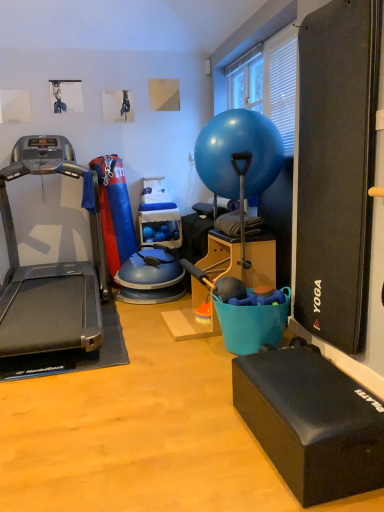
What is the approximate height of black rubber yoga block at lower right, the 2th box positioned from the top?

It is 10.48 inches.

The height and width of the screenshot is (512, 384). I want to click on glossy rubber ball at center, so click(x=239, y=153).

Is teal plastic bucket at center, marked as the 2th box in a bottom-to-top arrangement, oriented towards metallic gray treadmill at left?

Yes, teal plastic bucket at center, marked as the 2th box in a bottom-to-top arrangement, is aimed at metallic gray treadmill at left.

Measure the distance from teal plastic bucket at center, which ranks as the first box in back-to-front order, to metallic gray treadmill at left.

They are 1.17 meters apart.

Can you confirm if teal plastic bucket at center, which ranks as the first box in back-to-front order, is smaller than metallic gray treadmill at left?

Indeed, teal plastic bucket at center, which ranks as the first box in back-to-front order, has a smaller size compared to metallic gray treadmill at left.

What's the angular difference between teal plastic bucket at center, which ranks as the first box in back-to-front order, and metallic gray treadmill at left's facing directions?

The angular difference between teal plastic bucket at center, which ranks as the first box in back-to-front order, and metallic gray treadmill at left is 90 degrees.

Considering the positions of objects glossy rubber ball at center and teal plastic bucket at center, which ranks as the first box in back-to-front order, in the image provided, who is more to the left, glossy rubber ball at center or teal plastic bucket at center, which ranks as the first box in back-to-front order,?

Positioned to the left is teal plastic bucket at center, which ranks as the first box in back-to-front order.

Relative to teal plastic bucket at center, which ranks as the first box in back-to-front order, is glossy rubber ball at center in front or behind?

Visually, glossy rubber ball at center is located in front of teal plastic bucket at center, which ranks as the first box in back-to-front order.

Does glossy rubber ball at center touch teal plastic bucket at center, which is the 2th box in front-to-back order?

No, glossy rubber ball at center is not making contact with teal plastic bucket at center, which is the 2th box in front-to-back order.

From the image's perspective, would you say glossy rubber ball at center is shown under teal plastic bucket at center, which is the 2th box in front-to-back order?

No.

Would you say black rubber yoga block at lower right, the 2th box positioned from the top, is part of glossy rubber ball at center's contents?

That's incorrect, black rubber yoga block at lower right, the 2th box positioned from the top, is not inside glossy rubber ball at center.

Are glossy rubber ball at center and black rubber yoga block at lower right, the first box when ordered from bottom to top, beside each other?

They are not placed beside each other.

From the image's perspective, which one is positioned higher, glossy rubber ball at center or black rubber yoga block at lower right, the first box when ordered from bottom to top?

glossy rubber ball at center, from the image's perspective.

From a real-world perspective, between glossy rubber ball at center and black rubber yoga block at lower right, the 2th box positioned from the top, who is vertically lower?

black rubber yoga block at lower right, the 2th box positioned from the top, from a real-world perspective.

Does metallic gray treadmill at left appear on the right side of black rubber yoga block at lower right, the first box positioned from the front?

No, metallic gray treadmill at left is not to the right of black rubber yoga block at lower right, the first box positioned from the front.

Looking at the image, does metallic gray treadmill at left seem bigger or smaller compared to black rubber yoga block at lower right, the 2th box in the back-to-front sequence?

Clearly, metallic gray treadmill at left is larger in size than black rubber yoga block at lower right, the 2th box in the back-to-front sequence.

Is metallic gray treadmill at left turned away from black rubber yoga block at lower right, the 2th box positioned from the top?

That's not correct — metallic gray treadmill at left is not looking away from black rubber yoga block at lower right, the 2th box positioned from the top.

Can you confirm if metallic gray treadmill at left is taller than black rubber yoga block at lower right, the first box positioned from the front?

Yes.

Is point (257, 270) closer to viewer compared to point (264, 182)?

Yes, point (257, 270) is closer to viewer.

How far apart are teal plastic bucket at center, positioned as the first box in top-to-bottom order, and glossy rubber ball at center?

A: The distance of teal plastic bucket at center, positioned as the first box in top-to-bottom order, from glossy rubber ball at center is 20.46 inches.

What's the angular difference between teal plastic bucket at center, which ranks as the first box in back-to-front order, and glossy rubber ball at center's facing directions?

teal plastic bucket at center, which ranks as the first box in back-to-front order, and glossy rubber ball at center are facing 0.523 degrees away from each other.

Considering the sizes of teal plastic bucket at center, positioned as the first box in top-to-bottom order, and glossy rubber ball at center in the image, is teal plastic bucket at center, positioned as the first box in top-to-bottom order, bigger or smaller than glossy rubber ball at center?

In the image, teal plastic bucket at center, positioned as the first box in top-to-bottom order, appears to be larger than glossy rubber ball at center.

Considering the points (294, 397) and (274, 253), which point is behind, point (294, 397) or point (274, 253)?

The point (274, 253) is more distant.

Considering the relative sizes of black rubber yoga block at lower right, the 2th box in the back-to-front sequence, and teal plastic bucket at center, positioned as the first box in top-to-bottom order, in the image provided, is black rubber yoga block at lower right, the 2th box in the back-to-front sequence, thinner than teal plastic bucket at center, positioned as the first box in top-to-bottom order,?

Yes.

From the image's perspective, is black rubber yoga block at lower right, the 2th box in the back-to-front sequence, below teal plastic bucket at center, which ranks as the first box in back-to-front order?

Indeed, from the image's perspective, black rubber yoga block at lower right, the 2th box in the back-to-front sequence, is shown beneath teal plastic bucket at center, which ranks as the first box in back-to-front order.

This screenshot has height=512, width=384. In order to click on box that is on the right side of teal plastic bucket at center, marked as the 2th box in a bottom-to-top arrangement in this screenshot , I will do `click(311, 423)`.

From a real-world perspective, is glossy rubber ball at center physically below metallic gray treadmill at left?

No, from a real-world perspective, glossy rubber ball at center is not below metallic gray treadmill at left.

Considering the positions of objects glossy rubber ball at center and metallic gray treadmill at left in the image provided, who is behind, glossy rubber ball at center or metallic gray treadmill at left?

glossy rubber ball at center is more distant.

Is glossy rubber ball at center wider than metallic gray treadmill at left?

No, glossy rubber ball at center is not wider than metallic gray treadmill at left.

At what (x,y) coordinates should I click in order to perform the action: click on treadmill that is on the left side of teal plastic bucket at center, marked as the 2th box in a bottom-to-top arrangement. Please return your answer as a coordinate pair (x, y). The width and height of the screenshot is (384, 512). Looking at the image, I should click on coord(48,269).

At what (x,y) coordinates should I click in order to perform the action: click on ball in front of the teal plastic bucket at center, which is the 2th box in front-to-back order. Please return your answer as a coordinate pair (x, y). The image size is (384, 512). Looking at the image, I should click on (239, 153).

Estimate the real-world distances between objects in this image. Which object is further from metallic gray treadmill at left, glossy rubber ball at center or teal plastic bucket at center, which is the 2th box in front-to-back order?

glossy rubber ball at center is further to metallic gray treadmill at left.

In the scene shown: Considering their positions, is teal plastic bucket at center, which ranks as the first box in back-to-front order, positioned further to metallic gray treadmill at left than black rubber yoga block at lower right, the first box when ordered from bottom to top?

black rubber yoga block at lower right, the first box when ordered from bottom to top.

Looking at the image, which one is located closer to black rubber yoga block at lower right, the 2th box in the back-to-front sequence, metallic gray treadmill at left or teal plastic bucket at center, marked as the 2th box in a bottom-to-top arrangement?

Among the two, teal plastic bucket at center, marked as the 2th box in a bottom-to-top arrangement, is located nearer to black rubber yoga block at lower right, the 2th box in the back-to-front sequence.

Looking at the image, which one is located further to metallic gray treadmill at left, black rubber yoga block at lower right, the first box positioned from the front, or teal plastic bucket at center, which is the 2th box in front-to-back order?

black rubber yoga block at lower right, the first box positioned from the front, is further to metallic gray treadmill at left.

When comparing their distances from glossy rubber ball at center, does teal plastic bucket at center, positioned as the first box in top-to-bottom order, or black rubber yoga block at lower right, the 2th box positioned from the top, seem closer?

teal plastic bucket at center, positioned as the first box in top-to-bottom order, is positioned closer to the anchor glossy rubber ball at center.

Looking at the image, which one is located closer to metallic gray treadmill at left, teal plastic bucket at center, which is the 2th box in front-to-back order, or glossy rubber ball at center?

teal plastic bucket at center, which is the 2th box in front-to-back order, is positioned closer to the anchor metallic gray treadmill at left.

Based on their spatial positions, is glossy rubber ball at center or teal plastic bucket at center, which ranks as the first box in back-to-front order, closer to black rubber yoga block at lower right, the first box positioned from the front?

The object closer to black rubber yoga block at lower right, the first box positioned from the front, is teal plastic bucket at center, which ranks as the first box in back-to-front order.

Considering their positions, is glossy rubber ball at center positioned further to black rubber yoga block at lower right, the 2th box positioned from the top, than metallic gray treadmill at left?

metallic gray treadmill at left lies further to black rubber yoga block at lower right, the 2th box positioned from the top, than the other object.

The image size is (384, 512). Find the location of `treadmill between black rubber yoga block at lower right, the first box when ordered from bottom to top, and teal plastic bucket at center, which ranks as the first box in back-to-front order, from front to back`. treadmill between black rubber yoga block at lower right, the first box when ordered from bottom to top, and teal plastic bucket at center, which ranks as the first box in back-to-front order, from front to back is located at coordinates (48, 269).

Where is `box located between metallic gray treadmill at left and glossy rubber ball at center in the left-right direction`? box located between metallic gray treadmill at left and glossy rubber ball at center in the left-right direction is located at coordinates (240, 258).

At what (x,y) coordinates should I click in order to perform the action: click on ball between black rubber yoga block at lower right, the first box when ordered from bottom to top, and teal plastic bucket at center, positioned as the first box in top-to-bottom order, from front to back. Please return your answer as a coordinate pair (x, y). The image size is (384, 512). Looking at the image, I should click on point(239,153).

Find the location of a particular element. The image size is (384, 512). ball between metallic gray treadmill at left and black rubber yoga block at lower right, the first box when ordered from bottom to top, from left to right is located at coordinates (239, 153).